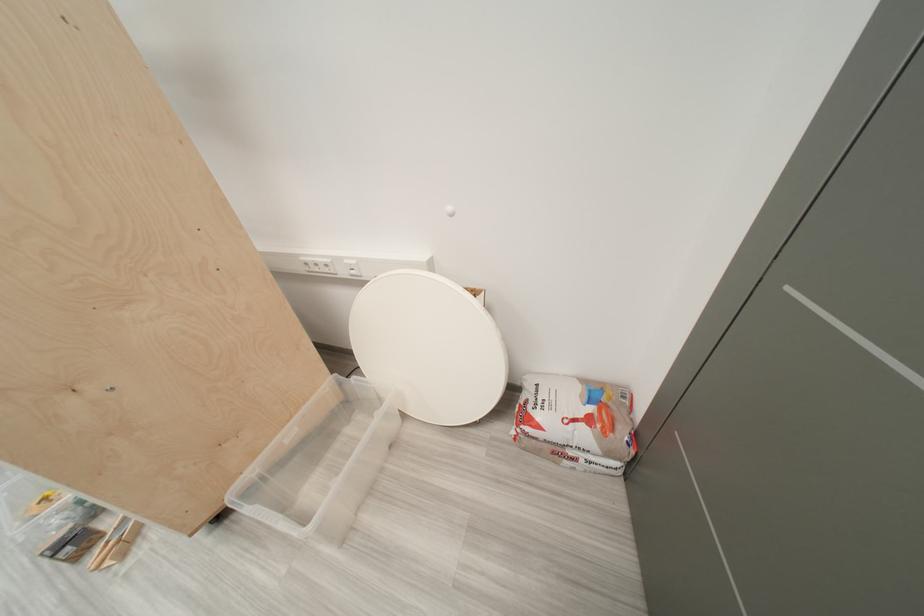
Describe the element at coordinates (321, 463) in the screenshot. Image resolution: width=924 pixels, height=616 pixels. I see `a clear plastic container` at that location.